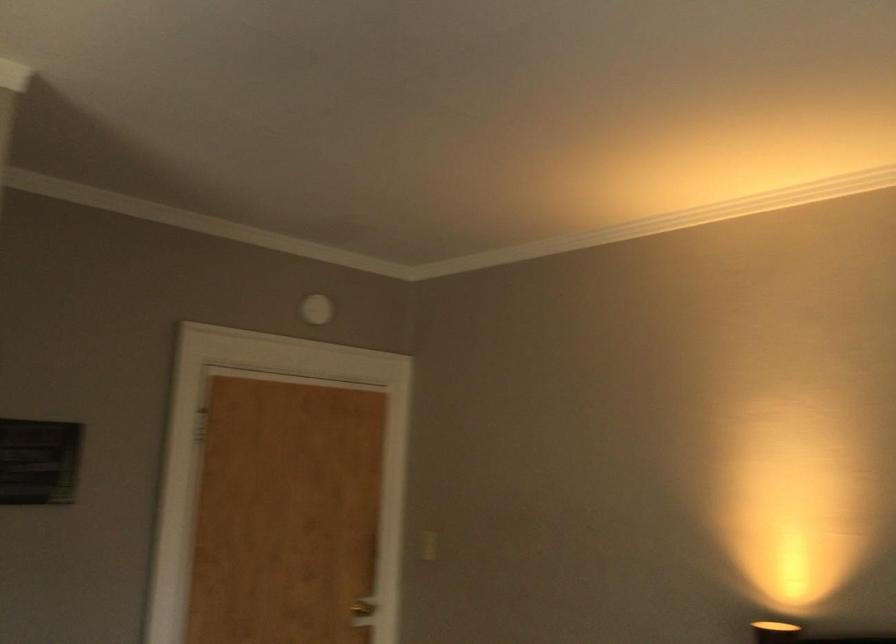
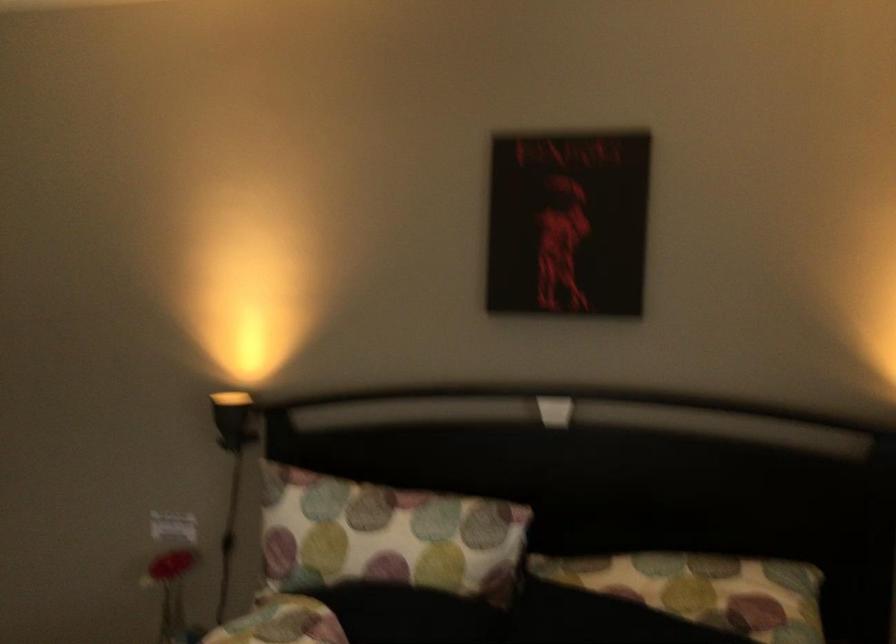
Question: Based on the continuous images, in which direction is the camera rotating? Reply with the corresponding letter.

Choices:
 (A) Left
 (B) Right
 (C) Up
 (D) Down

Answer: (B)